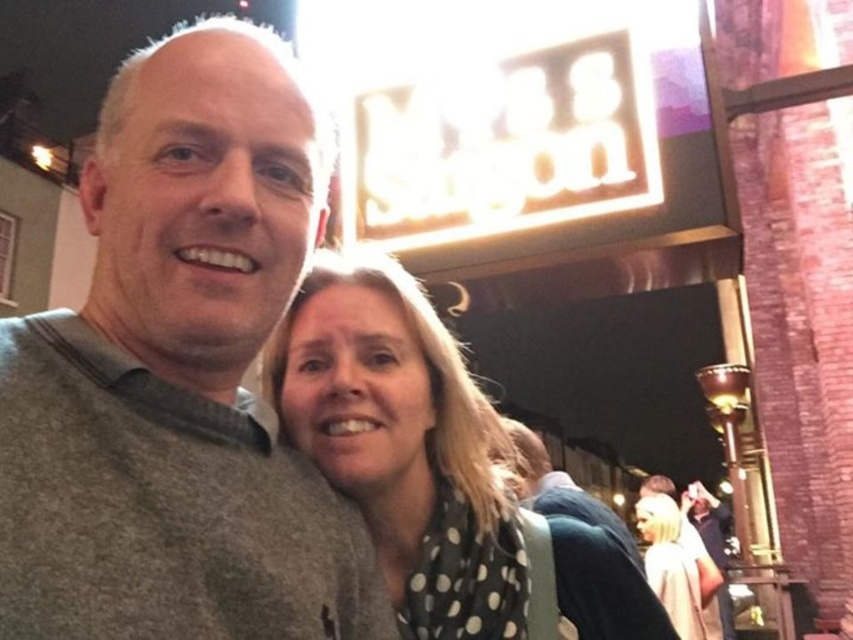
Who is positioned more to the left, gray sweater at left or dark gray sweater at center?

gray sweater at left is more to the left.

Is point (253, 228) farther from camera compared to point (553, 506)?

No, (253, 228) is in front of (553, 506).

At what (x,y) coordinates should I click in order to perform the action: click on gray sweater at left. Please return your answer as a coordinate pair (x, y). Looking at the image, I should click on (178, 372).

Measure the distance from black dotted scarf at center to white dotted scarf at lower right.

black dotted scarf at center is 5.72 meters from white dotted scarf at lower right.

From the picture: Who is lower down, black dotted scarf at center or white dotted scarf at lower right?

white dotted scarf at lower right

Image resolution: width=853 pixels, height=640 pixels. What do you see at coordinates (399, 442) in the screenshot?
I see `black dotted scarf at center` at bounding box center [399, 442].

This screenshot has height=640, width=853. What are the coordinates of `black dotted scarf at center` in the screenshot? It's located at (399, 442).

Which is behind, point (421, 312) or point (543, 493)?

The point (543, 493) is behind.

Does black dotted scarf at center have a lesser height compared to dark gray sweater at center?

Yes, black dotted scarf at center is shorter than dark gray sweater at center.

Who is more distant from viewer, (450, 429) or (637, 554)?

Point (637, 554)

The image size is (853, 640). Find the location of `black dotted scarf at center`. black dotted scarf at center is located at coordinates (399, 442).